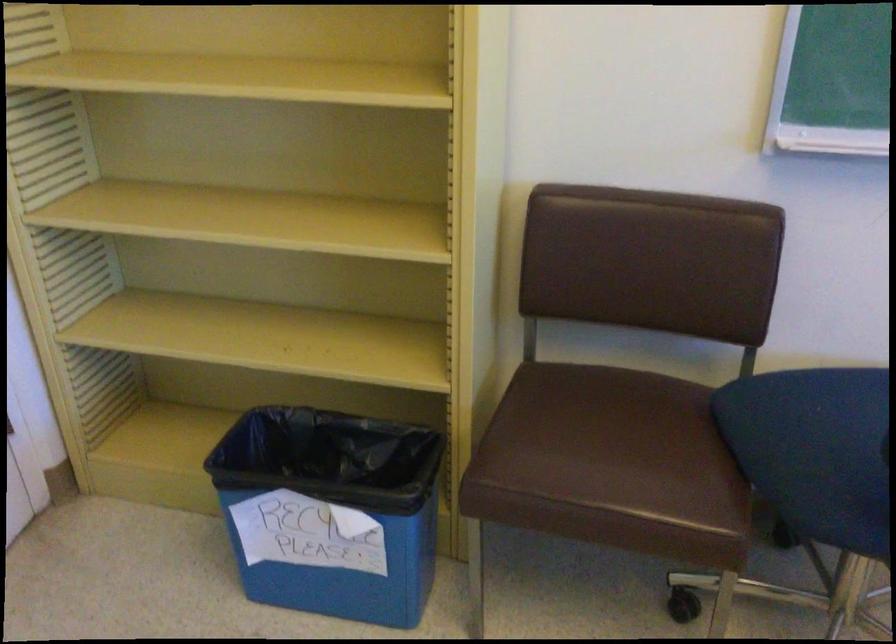
Locate an element on the screen. blue chair sitting surface is located at coordinates (814, 450).